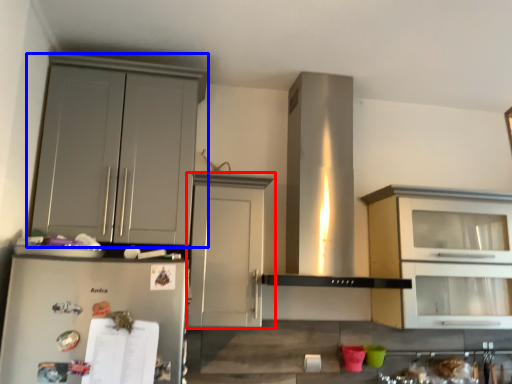
Question: Which point is further to the camera, cabinetry (highlighted by a red box) or cabinetry (highlighted by a blue box)?

Choices:
 (A) cabinetry
 (B) cabinetry

Answer: (A)